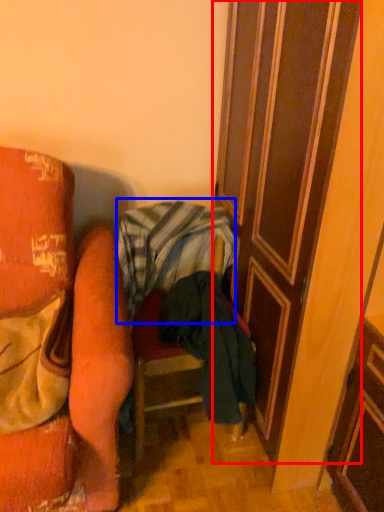
Question: Which object is further to the camera taking this photo, door (highlighted by a red box) or blanket (highlighted by a blue box)?

Choices:
 (A) door
 (B) blanket

Answer: (B)